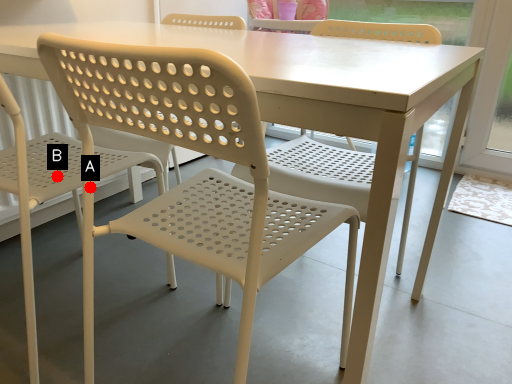
Question: Two points are circled on the image, labeled by A and B beside each circle. Which point is closer to the camera taking this photo?

Choices:
 (A) A is closer
 (B) B is closer

Answer: (A)